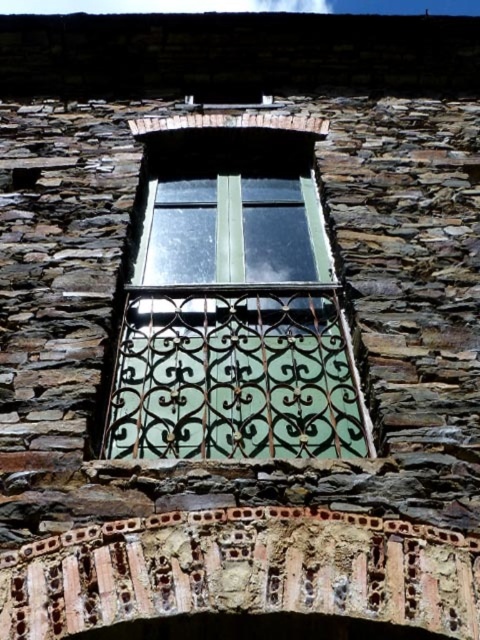
Question: In this image, where is green matte glass window at center located relative to rusty metal balcony at center?

Choices:
 (A) below
 (B) above

Answer: (B)

Question: Does green matte glass window at center lie in front of rusty metal balcony at center?

Choices:
 (A) no
 (B) yes

Answer: (A)

Question: Among these points, which one is nearest to the camera?

Choices:
 (A) (264, 202)
 (B) (45, 598)

Answer: (B)

Question: Can you confirm if green matte glass window at center is positioned above rusty metal balcony at center?

Choices:
 (A) no
 (B) yes

Answer: (B)